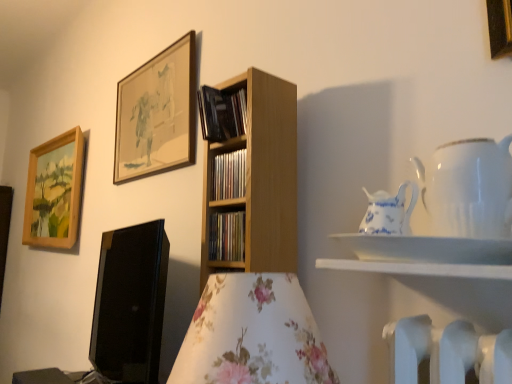
Question: In the image, is wooden shelf at center, the 1th book ordered from the bottom, positioned in front of or behind black matte book at upper center, marked as the 1th book in a top-to-bottom arrangement?

Choices:
 (A) behind
 (B) front

Answer: (B)

Question: From a real-world perspective, is wooden shelf at center, the third book viewed from the top, above or below black matte book at upper center, the 3th book when ordered from bottom to top?

Choices:
 (A) above
 (B) below

Answer: (B)

Question: Estimate the real-world distances between objects in this image. Which object is closer to the wooden shelf at center, the 1th book ordered from the bottom?

Choices:
 (A) white porcelain teapot at upper right, which is the 1th tableware from right to left
 (B) white glossy shelf at upper right
 (C) blue and white porcelain pitcher at upper right, the first tableware in the left-to-right sequence
 (D) black glossy computer monitor at lower left
 (E) black matte book at upper center, marked as the 1th book in a top-to-bottom arrangement

Answer: (E)

Question: Estimate the real-world distances between objects in this image. Which object is closer to the gold metallic picture frame at upper right, acting as the third picture frame starting from the left?

Choices:
 (A) blue and white porcelain pitcher at upper right, which appears as the 2th tableware when viewed from the right
 (B) wooden picture frame at upper left, which is the 1th picture frame in left-to-right order
 (C) white glossy shelf at upper right
 (D) wooden shelf at center, the third book viewed from the top
 (E) black matte book at upper center, the 3th book when ordered from bottom to top

Answer: (A)